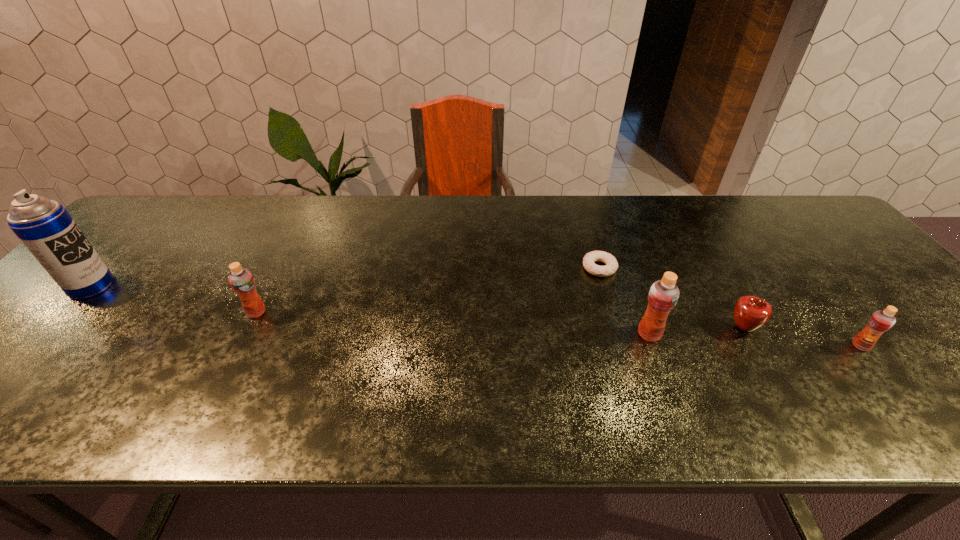
Where is `vacant position for inserting another orange_juice evenly`? The height and width of the screenshot is (540, 960). vacant position for inserting another orange_juice evenly is located at coordinates (448, 323).